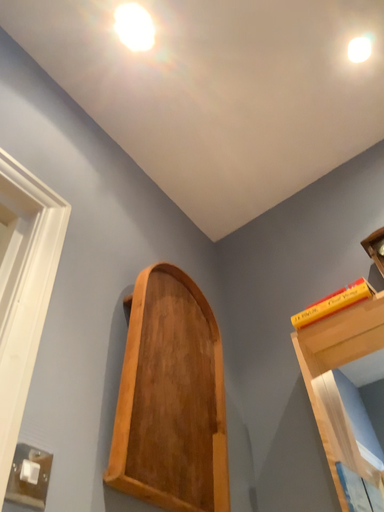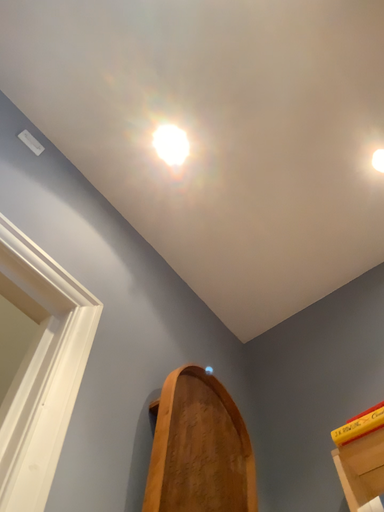
Question: Which way did the camera rotate in the video?

Choices:
 (A) rotated upward
 (B) rotated downward

Answer: (A)